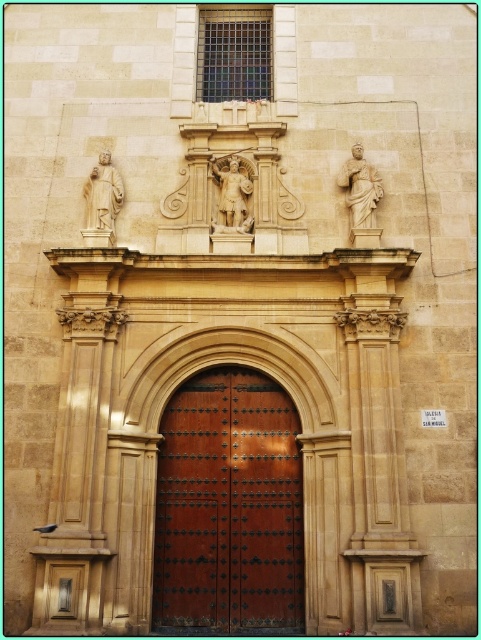
Which is below, brown wooden door at center or white marble statue at center?

brown wooden door at center is lower down.

Does brown wooden door at center appear on the left side of white marble statue at center?

Yes, brown wooden door at center is to the left of white marble statue at center.

What do you see at coordinates (228, 506) in the screenshot?
I see `brown wooden door at center` at bounding box center [228, 506].

What are the coordinates of `brown wooden door at center` in the screenshot? It's located at (228, 506).

Does light beige stone statue at upper left appear on the left side of white marble statue at center?

Correct, you'll find light beige stone statue at upper left to the left of white marble statue at center.

Between light beige stone statue at upper left and white marble statue at center, which one has less height?

white marble statue at center is shorter.

In order to click on light beige stone statue at upper left in this screenshot , I will do `click(102, 196)`.

The width and height of the screenshot is (481, 640). I want to click on light beige stone statue at upper left, so click(102, 196).

Is point (219, 456) in front of point (105, 160)?

Yes, it is in front of point (105, 160).

Identify the location of brown wooden door at center. The image size is (481, 640). (228, 506).

The height and width of the screenshot is (640, 481). I want to click on brown wooden door at center, so click(x=228, y=506).